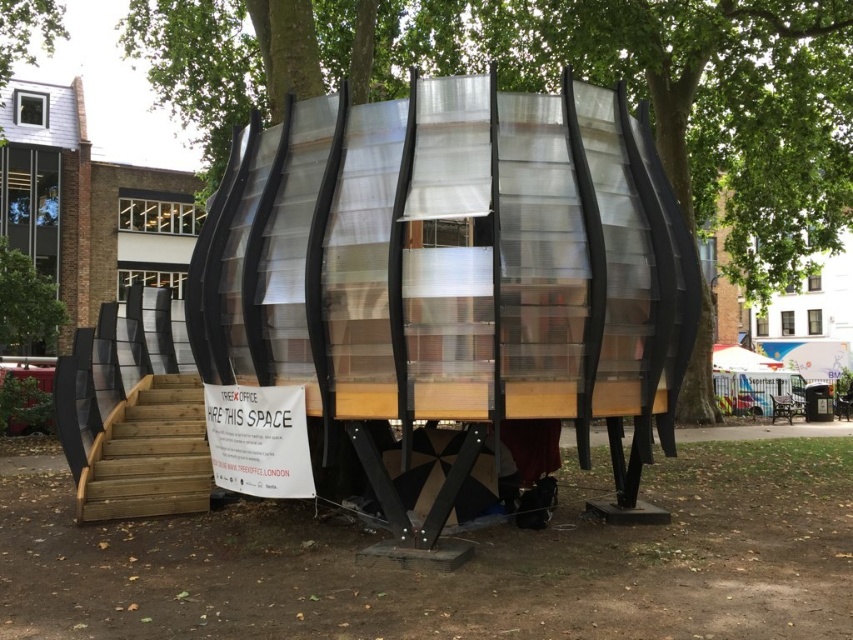
Who is taller, transparent plastic structure at center or wooden stairs at lower left?

Standing taller between the two is transparent plastic structure at center.

At what (x,y) coordinates should I click in order to perform the action: click on transparent plastic structure at center. Please return your answer as a coordinate pair (x, y). Looking at the image, I should click on (451, 269).

Is point (125, 179) positioned in front of point (125, 456)?

No.

Does point (68, 253) lie in front of point (202, 483)?

No.

Where is `metallic silver hut at upper center`? This screenshot has height=640, width=853. metallic silver hut at upper center is located at coordinates point(86,204).

Does transparent plastic structure at center have a lesser width compared to green leafy tree at upper left?

Indeed, transparent plastic structure at center has a lesser width compared to green leafy tree at upper left.

Does transparent plastic structure at center have a larger size compared to green leafy tree at upper left?

Actually, transparent plastic structure at center might be smaller than green leafy tree at upper left.

I want to click on transparent plastic structure at center, so click(451, 269).

Locate an element on the screen. transparent plastic structure at center is located at coordinates (451, 269).